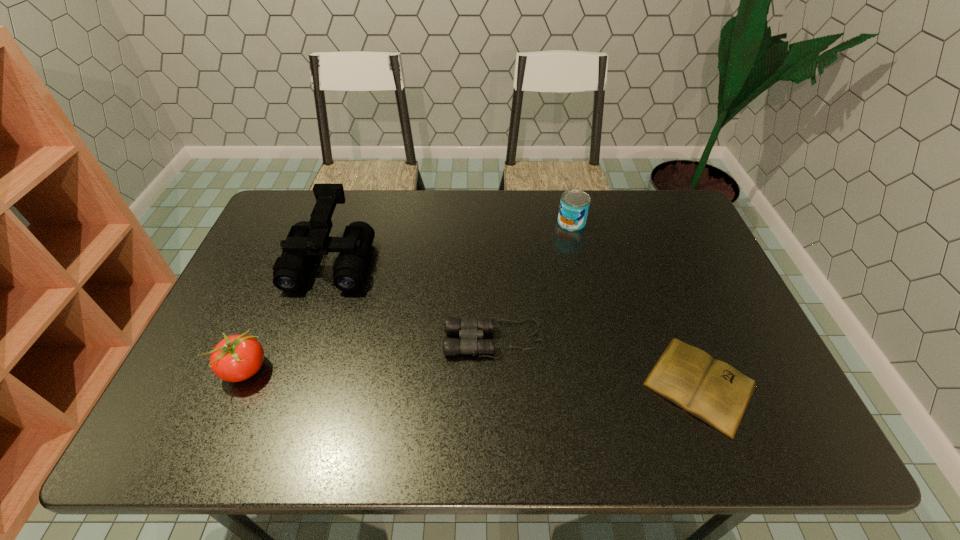
Image resolution: width=960 pixels, height=540 pixels. Identify the location of the taller binoculars. (305, 239).

At what (x,y) coordinates should I click in order to perform the action: click on the tallest object. Please return your answer as a coordinate pair (x, y). Looking at the image, I should click on (305, 239).

Locate an element on the screen. tomato is located at coordinates coord(236,358).

Locate an element on the screen. This screenshot has width=960, height=540. the fourth object from left to right is located at coordinates (574, 205).

Identify the location of the second shortest object. The image size is (960, 540). (469, 330).

Locate an element on the screen. The image size is (960, 540). the nearer binoculars is located at coordinates (469, 330).

This screenshot has width=960, height=540. In order to click on the rightmost object in this screenshot , I will do `click(715, 392)`.

At what (x,y) coordinates should I click in order to perform the action: click on book. Please return your answer as a coordinate pair (x, y). Image resolution: width=960 pixels, height=540 pixels. Looking at the image, I should click on (715, 392).

In order to click on vacant space located 0.120m on the front lenses of the left binoculars in this screenshot , I will do `click(308, 328)`.

Where is `free region located 0.070m on the left of the tomato`? free region located 0.070m on the left of the tomato is located at coordinates (193, 370).